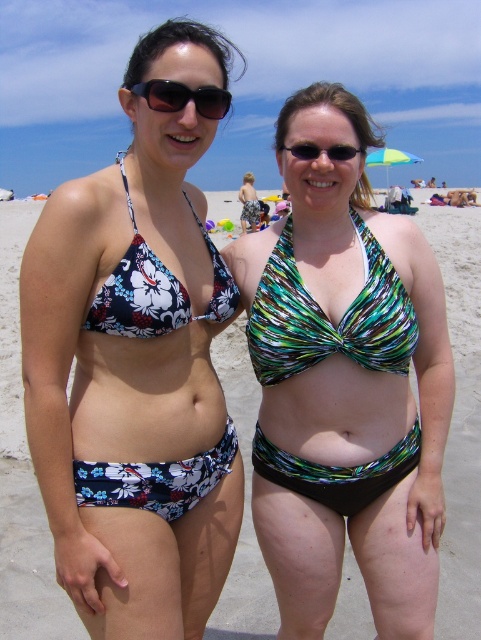
You are a photographer trying to capture a closeup shot of the green and white printed bikini top at center. The camera you are using has a focal length of 50mm and an aperture of f2.8. Can you determine if the bikini top is within the camera sensor area of 0.6 to 0.7 on the x and y coordinates?

The position of green and white printed bikini top at center is at point (344, 385). Since the x coordinate 0.602 is within 0.6 to 0.7 and the y coordinate 0.717 is also within 0.6 to 0.7, the bikini top is within the camera sensor area.

You are a photographer on the beach and want to capture a shot of the multicolored bikini top at center and the matte black sunglasses at upper center. Which object is positioned to the right of the other?

The multicolored bikini top at center is to the right of matte black sunglasses at upper center.